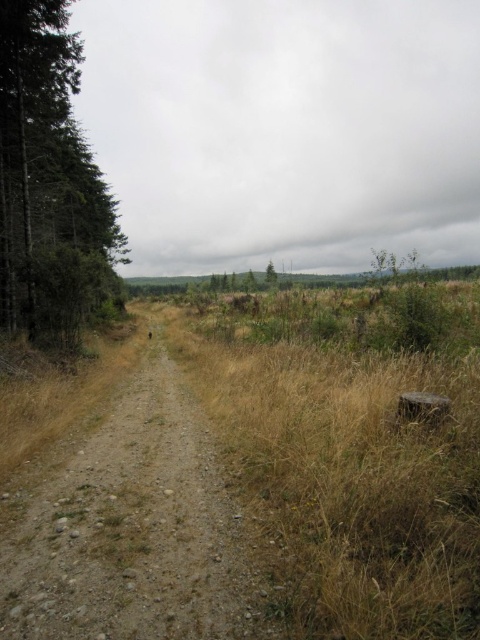
Who is positioned more to the left, dry grass at center or green matte tree at center?

dry grass at center is more to the left.

Locate an element on the screen. dry grass at center is located at coordinates (350, 477).

Measure the distance between point (x=302, y=593) and camera.

The distance of point (x=302, y=593) from camera is 33.21 feet.

Where is `dry grass at center`? The width and height of the screenshot is (480, 640). dry grass at center is located at coordinates (350, 477).

Measure the distance between dark green textured tree at left and green matte tree at center.

A distance of 174.48 meters exists between dark green textured tree at left and green matte tree at center.

Between dark green textured tree at left and green matte tree at center, which one has more height?

With more height is green matte tree at center.

Find the location of a particular element. dark green textured tree at left is located at coordinates (48, 182).

Identify the location of dark green textured tree at left. The height and width of the screenshot is (640, 480). (48, 182).

Does dry grass at center have a greater height compared to dirt/gravel trail at center?

Yes.

Between dry grass at center and dirt/gravel trail at center, which one is positioned higher?

dry grass at center

Is point (448, 586) positioned in front of point (172, 396)?

Yes, it is in front of point (172, 396).

Locate an element on the screen. The image size is (480, 640). dry grass at center is located at coordinates (350, 477).